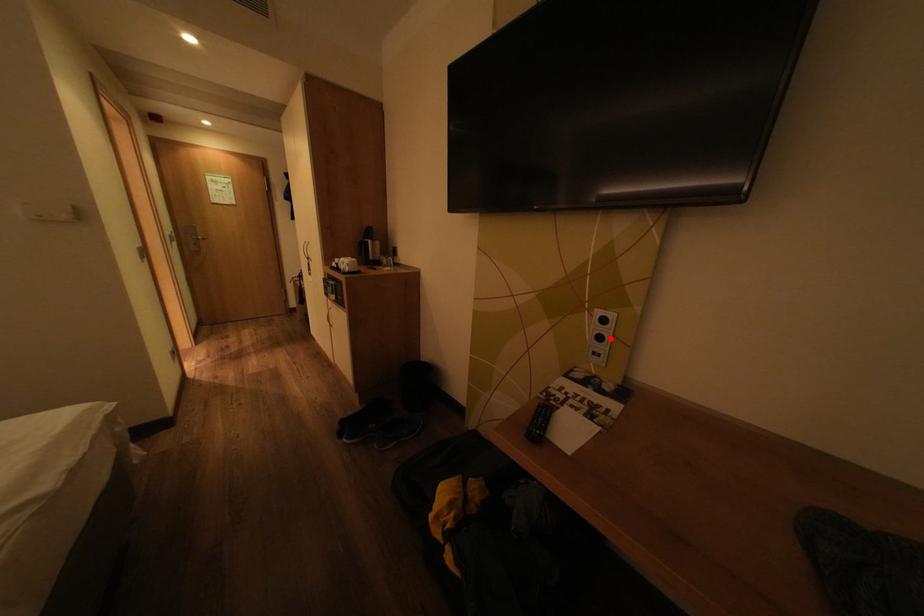
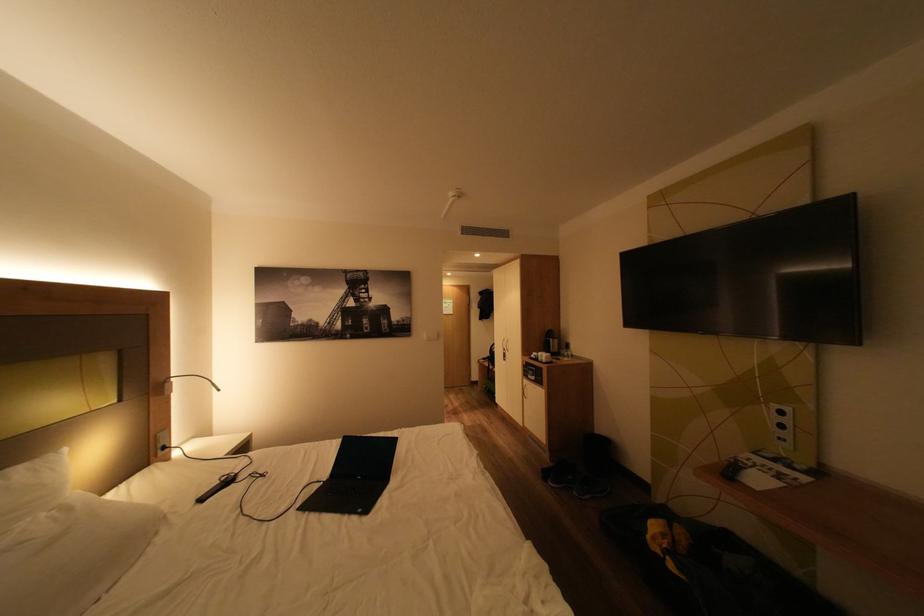
Find the pixel in the second image that matches the highlighted location in the first image.

(793, 427)